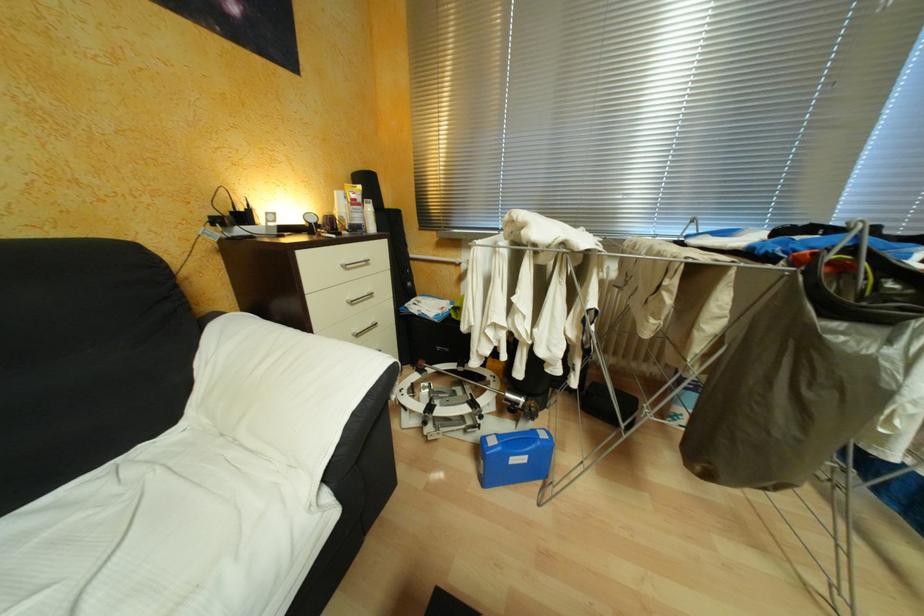
The location [369,216] corresponds to which object?

It refers to a white pump bottle.